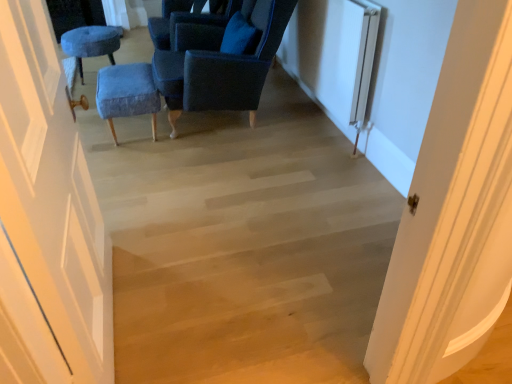
Where is `free point above velvet blue ottoman at upper left, the second furniture in the bottom-to-top sequence (from a real-world perspective)`? The width and height of the screenshot is (512, 384). free point above velvet blue ottoman at upper left, the second furniture in the bottom-to-top sequence (from a real-world perspective) is located at coordinates (90, 33).